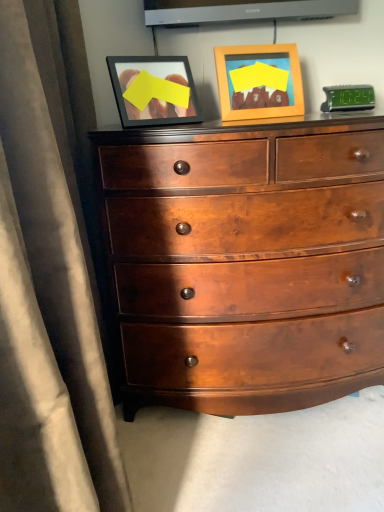
Question: Visually, is wooden picture frame at upper center positioned to the left or to the right of glossy wood chest of drawers at center?

Choices:
 (A) right
 (B) left

Answer: (A)

Question: Which is correct: wooden picture frame at upper center is inside glossy wood chest of drawers at center, or outside of it?

Choices:
 (A) outside
 (B) inside

Answer: (A)

Question: In terms of size, does wooden picture frame at upper center appear bigger or smaller than glossy wood chest of drawers at center?

Choices:
 (A) small
 (B) big

Answer: (A)

Question: Looking at their shapes, would you say glossy wood chest of drawers at center is wider or thinner than wooden picture frame at upper center?

Choices:
 (A) thin
 (B) wide

Answer: (B)

Question: From the image's perspective, relative to wooden picture frame at upper center, is glossy wood chest of drawers at center above or below?

Choices:
 (A) above
 (B) below

Answer: (B)

Question: Would you say glossy wood chest of drawers at center is inside or outside wooden picture frame at upper center?

Choices:
 (A) outside
 (B) inside

Answer: (A)

Question: Does point (256, 169) appear closer or farther from the camera than point (223, 117)?

Choices:
 (A) closer
 (B) farther

Answer: (A)